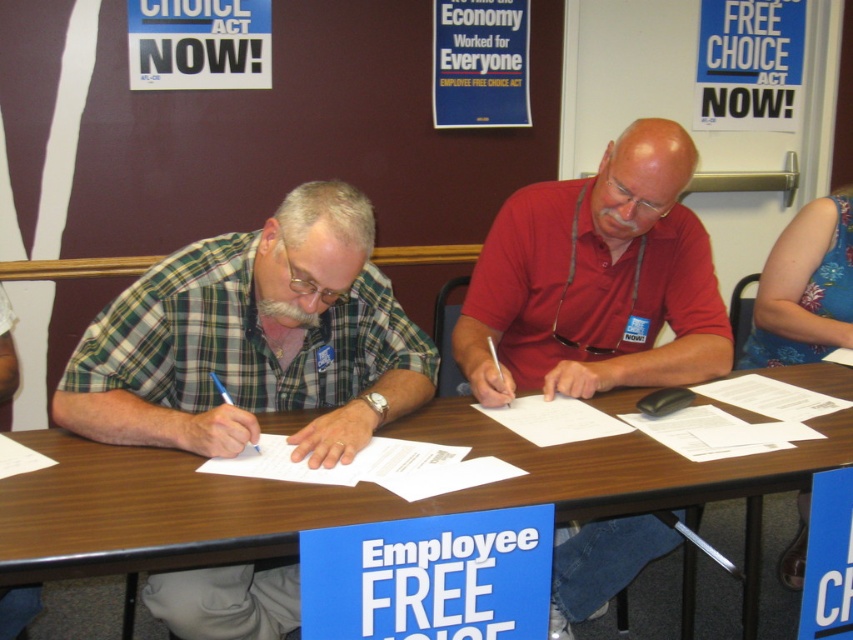
Which of these two, green plaid shirt at left or matte red shirt at center, stands shorter?

With less height is green plaid shirt at left.

Does point (212, 342) come in front of point (704, 289)?

Yes, point (212, 342) is closer to viewer.

Find the location of `green plaid shirt at left`. green plaid shirt at left is located at coordinates (254, 340).

Describe the element at coordinates (596, 280) in the screenshot. I see `matte red shirt at center` at that location.

Is matte red shirt at center taller than white paper at center?

Indeed, matte red shirt at center has a greater height compared to white paper at center.

Does point (608, 292) come farther from viewer compared to point (405, 474)?

Yes, point (608, 292) is behind point (405, 474).

Where is `matte red shirt at center`? matte red shirt at center is located at coordinates (596, 280).

Is green plaid shirt at left shorter than brown wood table at center?

No.

Can you confirm if green plaid shirt at left is positioned below brown wood table at center?

Actually, green plaid shirt at left is above brown wood table at center.

Which is in front, point (192, 253) or point (115, 506)?

Point (115, 506)

You are a GUI agent. You are given a task and a screenshot of the screen. Output one action in this format:
    pyautogui.click(x=<x>, y=<y>)
    Task: Click on the green plaid shirt at left
    
    Given the screenshot: What is the action you would take?
    pyautogui.click(x=254, y=340)